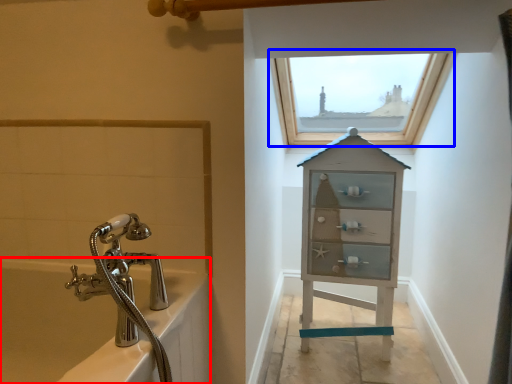
Question: Which of the following is the farthest to the observer, bath (highlighted by a red box) or window (highlighted by a blue box)?

Choices:
 (A) bath
 (B) window

Answer: (B)